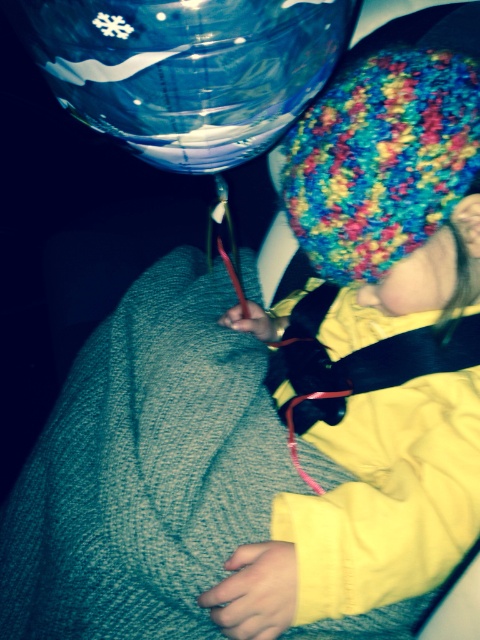
Can you confirm if knitted multicolor hat at center is wider than multicolored knitted hat at upper right?

Indeed, knitted multicolor hat at center has a greater width compared to multicolored knitted hat at upper right.

Between knitted multicolor hat at center and multicolored knitted hat at upper right, which one appears on the left side from the viewer's perspective?

knitted multicolor hat at center

This screenshot has height=640, width=480. Identify the location of knitted multicolor hat at center. (389, 195).

Does knitted multicolor hat at center appear on the left side of transparent plastic balloon at upper center?

In fact, knitted multicolor hat at center is to the right of transparent plastic balloon at upper center.

Is point (368, 500) farther from viewer compared to point (97, 129)?

Yes, it is behind point (97, 129).

I want to click on knitted multicolor hat at center, so click(389, 195).

Who is higher up, transparent plastic balloon at upper center or multicolored knitted hat at upper right?

transparent plastic balloon at upper center is higher up.

Is transparent plastic balloon at upper center to the right of multicolored knitted hat at upper right from the viewer's perspective?

Incorrect, transparent plastic balloon at upper center is not on the right side of multicolored knitted hat at upper right.

What do you see at coordinates (186, 68) in the screenshot? I see `transparent plastic balloon at upper center` at bounding box center [186, 68].

I want to click on transparent plastic balloon at upper center, so click(186, 68).